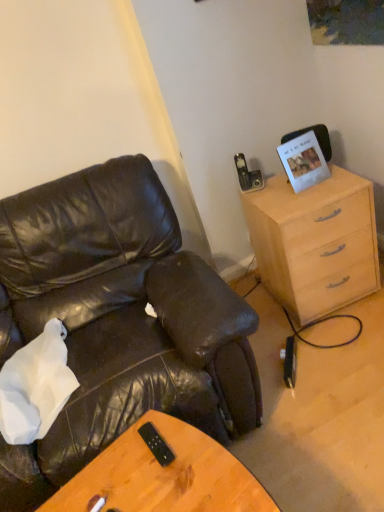
Identify the location of free point above woodendesk at lower center (from a real-world perspective). This screenshot has height=512, width=384. (160, 479).